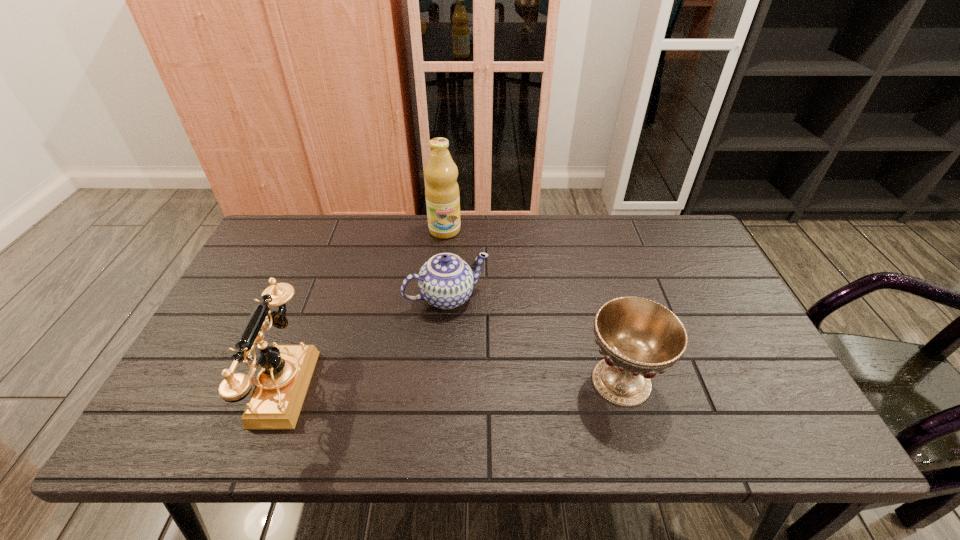
This screenshot has width=960, height=540. I want to click on vacant space on the desktop that is between the third shortest object and the third tallest object and is positioned on the label of the olive oil, so click(x=471, y=383).

In order to click on vacant space on the desktop that is between the second tallest object and the second shortest object and is positioned at the spout of the second farthest object in this screenshot , I will do `click(493, 383)`.